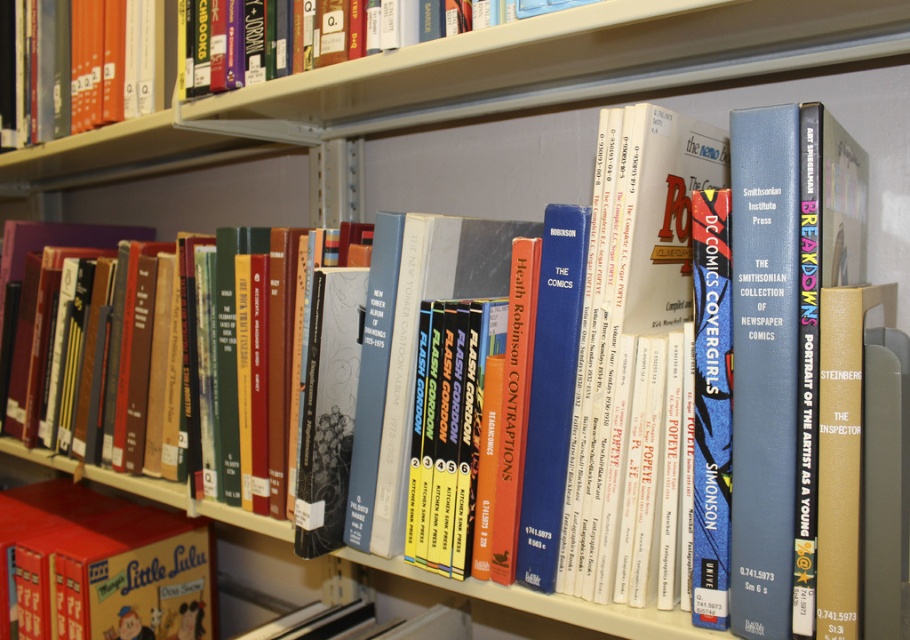
Does matte red book at lower left have a lesser width compared to hardcover book at upper left?

No.

Is matte red book at lower left above hardcover book at upper left?

Actually, matte red book at lower left is below hardcover book at upper left.

At what (x,y) coordinates should I click in order to perform the action: click on matte red book at lower left. Please return your answer as a coordinate pair (x, y). This screenshot has height=640, width=910. Looking at the image, I should click on (100, 566).